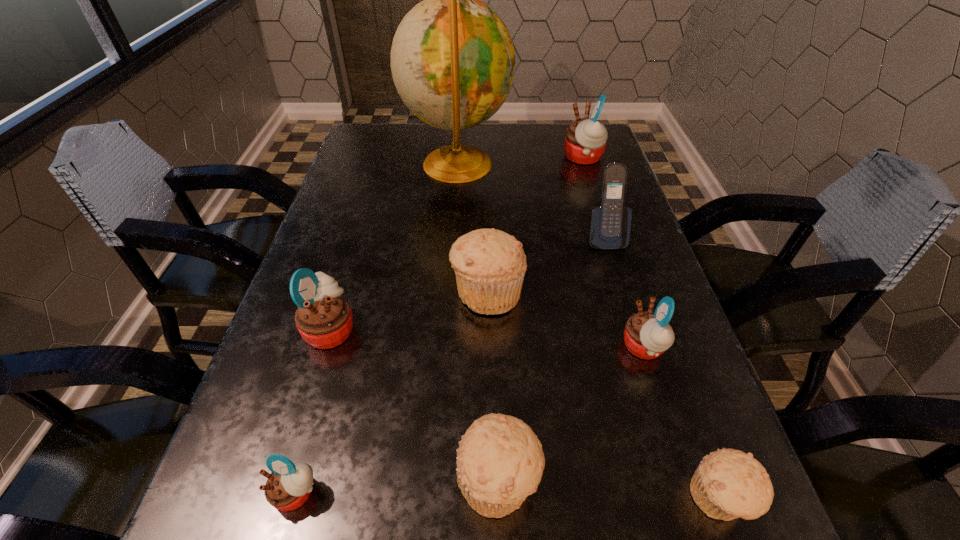
You are a GUI agent. You are given a task and a screenshot of the screen. Output one action in this format:
    pyautogui.click(x=<x>, y=<y>)
    Task: Click on the free space located 0.120m on the back of the second biggest beige muffin
    The height and width of the screenshot is (540, 960).
    Given the screenshot: What is the action you would take?
    pyautogui.click(x=495, y=374)

Locate an element on the screen. blank area located on the back of the rightmost beige muffin is located at coordinates (662, 340).

Image resolution: width=960 pixels, height=540 pixels. I want to click on globe that is positioned at the far edge, so click(453, 62).

You are a GUI agent. You are given a task and a screenshot of the screen. Output one action in this format:
    pyautogui.click(x=<x>, y=<y>)
    Task: Click on the muffin situated at the far edge
    The height and width of the screenshot is (540, 960).
    Given the screenshot: What is the action you would take?
    pyautogui.click(x=585, y=140)

You are a GUI agent. You are given a task and a screenshot of the screen. Output one action in this format:
    pyautogui.click(x=<x>, y=<y>)
    Task: Click on the globe at the left edge
    The height and width of the screenshot is (540, 960).
    Given the screenshot: What is the action you would take?
    pyautogui.click(x=453, y=62)

The height and width of the screenshot is (540, 960). I want to click on cellular telephone positioned at the right edge, so click(x=610, y=224).

Identify the location of object that is at the far left corner. The height and width of the screenshot is (540, 960). (453, 62).

Locate an element on the screen. The width and height of the screenshot is (960, 540). object at the far right corner is located at coordinates (585, 140).

This screenshot has width=960, height=540. I want to click on vacant space at the far edge of the desktop, so click(525, 143).

Where is `free space at the left edge of the desktop`? This screenshot has width=960, height=540. free space at the left edge of the desktop is located at coordinates (371, 265).